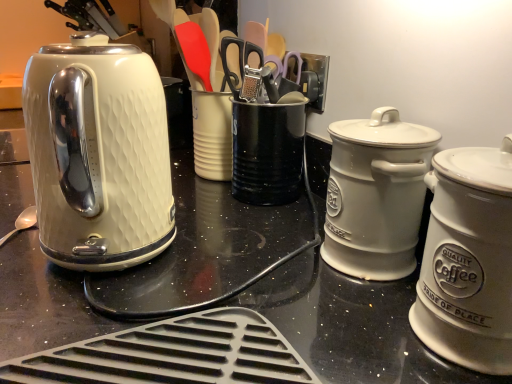
Question: From a real-world perspective, is silver metallic spoon at lower left below matte white kettle at left?

Choices:
 (A) no
 (B) yes

Answer: (B)

Question: Is matte white kettle at left inside silver metallic spoon at lower left?

Choices:
 (A) yes
 (B) no

Answer: (B)

Question: Considering the relative sizes of silver metallic spoon at lower left and matte white kettle at left in the image provided, is silver metallic spoon at lower left bigger than matte white kettle at left?

Choices:
 (A) no
 (B) yes

Answer: (A)

Question: Is silver metallic spoon at lower left behind matte white kettle at left?

Choices:
 (A) yes
 (B) no

Answer: (A)

Question: Considering the relative sizes of silver metallic spoon at lower left and matte white kettle at left in the image provided, is silver metallic spoon at lower left smaller than matte white kettle at left?

Choices:
 (A) yes
 (B) no

Answer: (A)

Question: Is white ceramic canister at right, the first kitchen appliance in the back-to-front sequence, wider or thinner than black metal canister at center?

Choices:
 (A) thin
 (B) wide

Answer: (A)

Question: Based on their sizes in the image, would you say white ceramic canister at right, the first kitchen appliance in the back-to-front sequence, is bigger or smaller than black metal canister at center?

Choices:
 (A) small
 (B) big

Answer: (A)

Question: Is point (413, 188) closer or farther from the camera than point (264, 125)?

Choices:
 (A) farther
 (B) closer

Answer: (B)

Question: From the image's perspective, is white ceramic canister at right, the first kitchen appliance in the back-to-front sequence, positioned above or below black metal canister at center?

Choices:
 (A) below
 (B) above

Answer: (A)

Question: Is silver metallic spoon at lower left taller or shorter than white ceramic canister at right, the second kitchen appliance in the front-to-back sequence?

Choices:
 (A) tall
 (B) short

Answer: (B)

Question: Considering the positions of silver metallic spoon at lower left and white ceramic canister at right, the second kitchen appliance in the front-to-back sequence, in the image, is silver metallic spoon at lower left wider or thinner than white ceramic canister at right, the second kitchen appliance in the front-to-back sequence,?

Choices:
 (A) thin
 (B) wide

Answer: (A)

Question: Considering the relative positions of silver metallic spoon at lower left and white ceramic canister at right, the first kitchen appliance in the back-to-front sequence, in the image provided, is silver metallic spoon at lower left to the left or to the right of white ceramic canister at right, the first kitchen appliance in the back-to-front sequence,?

Choices:
 (A) left
 (B) right

Answer: (A)

Question: Is silver metallic spoon at lower left bigger or smaller than white ceramic canister at right, the first kitchen appliance in the back-to-front sequence?

Choices:
 (A) small
 (B) big

Answer: (A)

Question: Is matte white kettle at left wider or thinner than white ceramic canister at right, marked as the first kitchen appliance in a front-to-back arrangement?

Choices:
 (A) wide
 (B) thin

Answer: (A)

Question: Considering the relative positions of matte white kettle at left and white ceramic canister at right, marked as the first kitchen appliance in a front-to-back arrangement, in the image provided, is matte white kettle at left to the left or to the right of white ceramic canister at right, marked as the first kitchen appliance in a front-to-back arrangement,?

Choices:
 (A) right
 (B) left

Answer: (B)